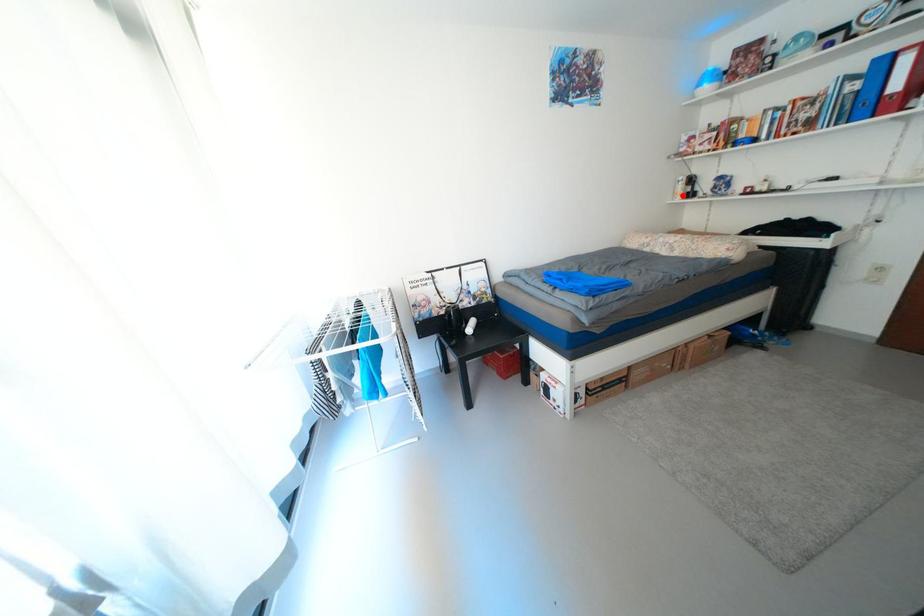
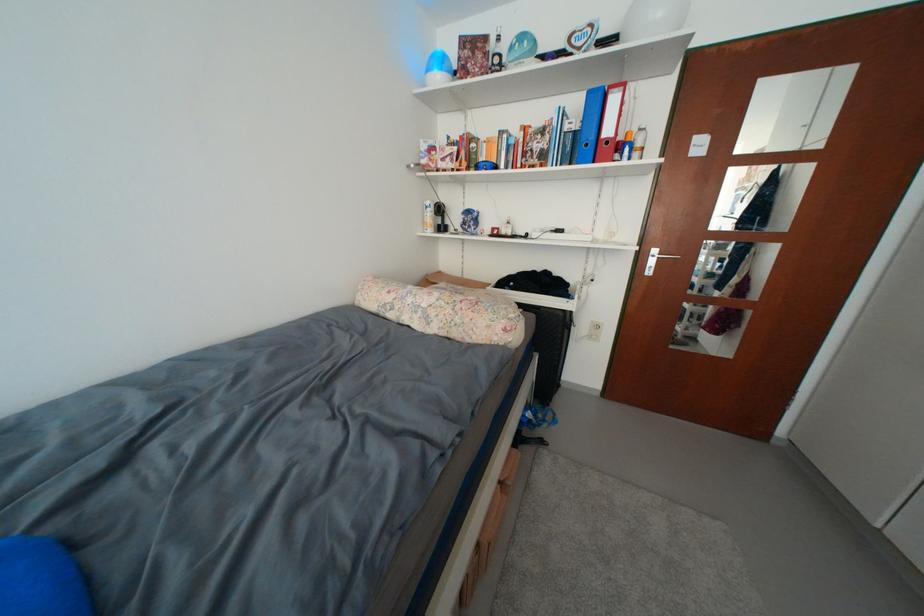
Where in the second image is the point corresponding to the highlighted location from the first image?

(432, 225)